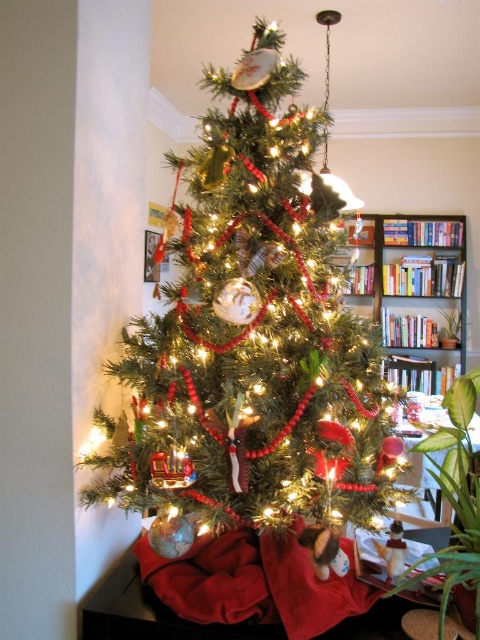
You are standing in front of the Christmas tree and want to place a small gift. You have two points marked on the tree where you can place it. Which point is closer to you, point (245, 504) or point (456, 262)?

Point (245, 504) is closer to the viewer than point (456, 262), so you should place the gift there if you want it closer to you.

You are standing in the living room where the green matte christmas tree at center is displayed. If you were to walk directly towards the tree from the entrance, which direction should you move relative to the bookshelf in the background?

The green matte christmas tree at center is located at point coordinates of (252, 336). Since the bookshelf is in the background, you should move towards the center of the room to reach the tree directly.

You are planning to move the green matte christmas tree at center to a new location that can only accommodate items narrower than the wooden bookshelf at center. Based on the scene, will the tree fit in the new space?

The green matte christmas tree at center has a width less than the wooden bookshelf at center, so it will fit in the new space designed for items narrower than the bookshelf.